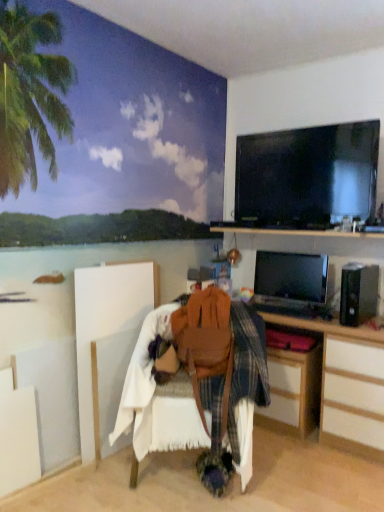
Question: From the image's perspective, is brown leather bag at center located above or below wooden desk at lower right?

Choices:
 (A) below
 (B) above

Answer: (B)

Question: Based on their sizes in the image, would you say brown leather bag at center is bigger or smaller than wooden desk at lower right?

Choices:
 (A) big
 (B) small

Answer: (B)

Question: Which object is the closest to the wooden desk at lower right?

Choices:
 (A) wooden desk at lower right
 (B) brown leather bag at center
 (C) satin black monitor at right, which ranks as the first television in bottom-to-top order
 (D) leather at center
 (E) ocean mural at upper left

Answer: (A)

Question: Estimate the real-world distances between objects in this image. Which object is closer to the satin black monitor at right, which ranks as the first television in bottom-to-top order?

Choices:
 (A) wooden desk at lower right
 (B) ocean mural at upper left
 (C) wooden desk at lower right
 (D) black glossy screen at upper right, the second television positioned from the bottom
 (E) brown leather bag at center

Answer: (A)